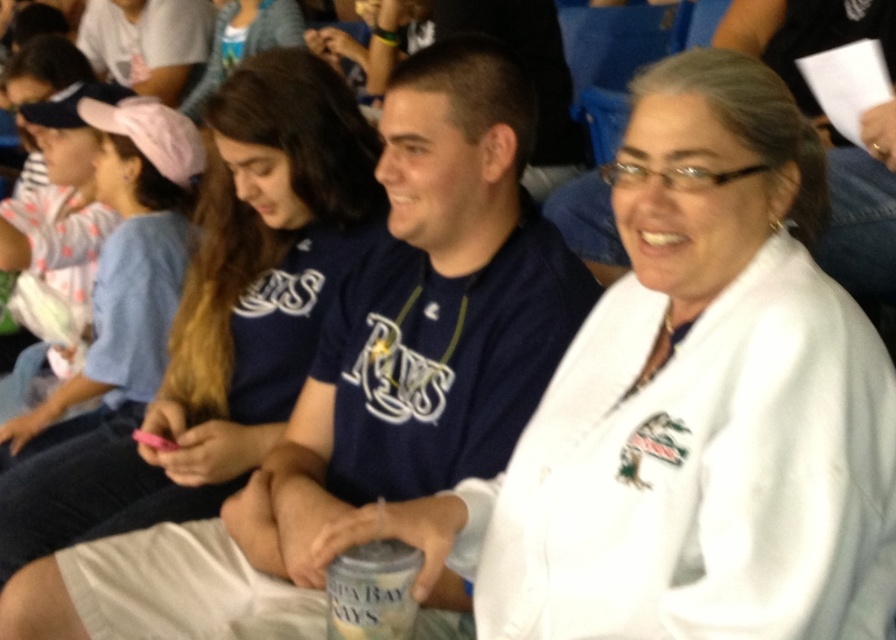
Find the location of a particular element. matte blue shirt at center is located at coordinates (225, 314).

Is matte blue shirt at center below white fleece robe at center?

No.

Describe the element at coordinates (225, 314) in the screenshot. This screenshot has height=640, width=896. I see `matte blue shirt at center` at that location.

Locate an element on the screen. Image resolution: width=896 pixels, height=640 pixels. matte blue shirt at center is located at coordinates (225, 314).

Is white fleece robe at center to the left of pink fabric cap at upper left from the viewer's perspective?

No, white fleece robe at center is not to the left of pink fabric cap at upper left.

Is point (337, 340) closer to camera compared to point (168, 115)?

Yes, it is in front of point (168, 115).

Image resolution: width=896 pixels, height=640 pixels. Identify the location of white fleece robe at center. (436, 369).

Is matte blue shirt at center bigger than pink fabric cap at upper left?

Yes, matte blue shirt at center is bigger than pink fabric cap at upper left.

Between matte blue shirt at center and pink fabric cap at upper left, which one is positioned lower?

matte blue shirt at center is below.

Is point (328, 76) closer to viewer compared to point (159, 228)?

Yes, it is.

Find the location of a particular element. The image size is (896, 640). matte blue shirt at center is located at coordinates (225, 314).